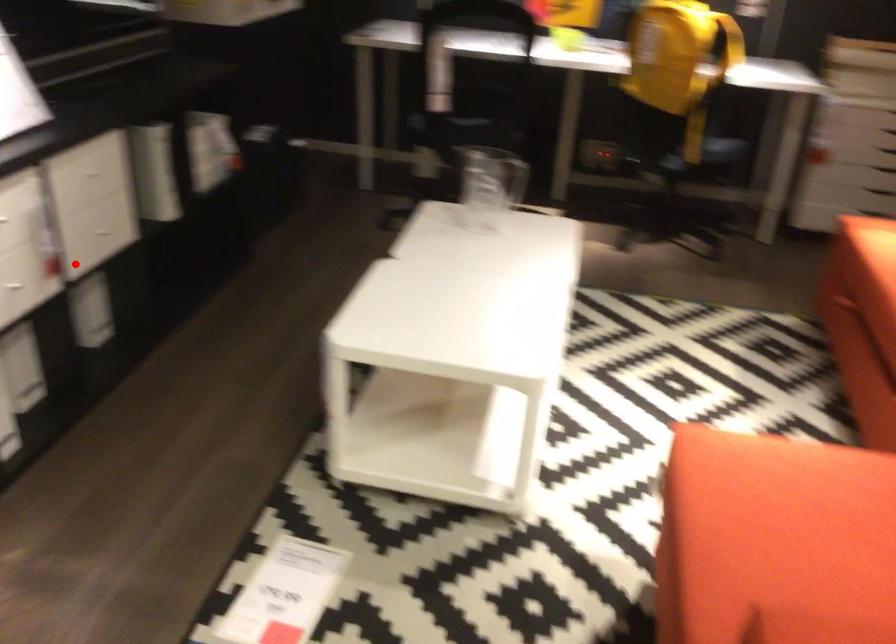
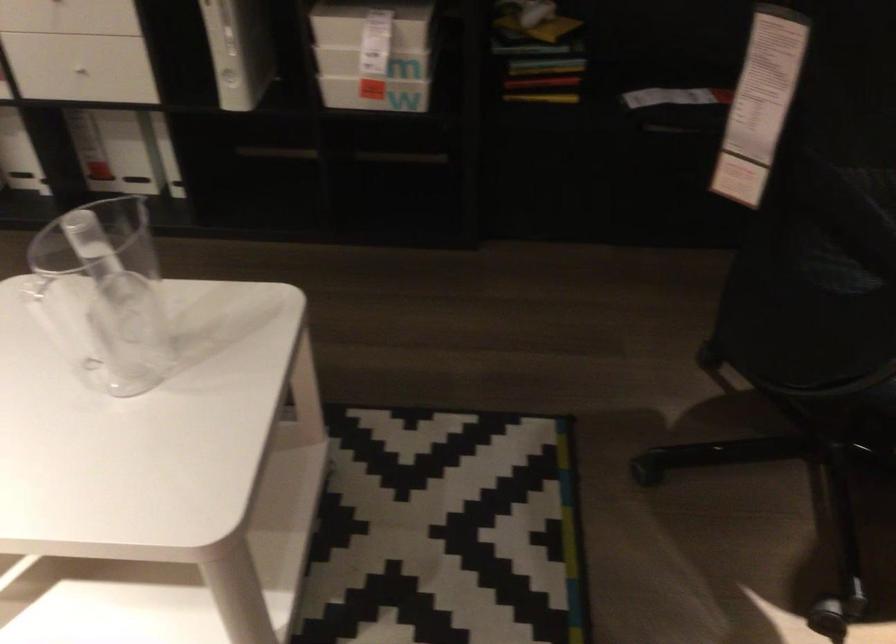
In the second image, find the point that corresponds to the highlighted location in the first image.

(75, 77)